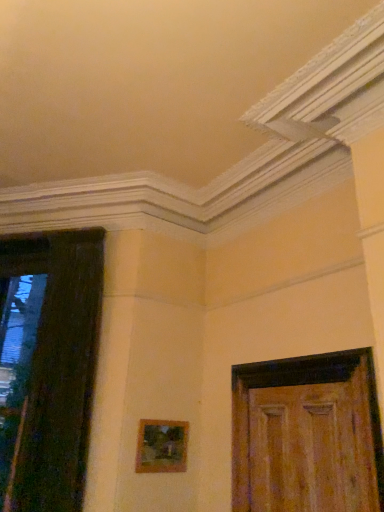
Question: Is wooden frame at center thinner than dark wood door at left, which is counted as the 1th door, starting from the left?

Choices:
 (A) no
 (B) yes

Answer: (B)

Question: From a real-world perspective, is wooden frame at center over dark wood door at left, acting as the 2th door starting from the right?

Choices:
 (A) yes
 (B) no

Answer: (B)

Question: Does wooden frame at center have a smaller size compared to dark wood door at left, which is counted as the 1th door, starting from the left?

Choices:
 (A) yes
 (B) no

Answer: (A)

Question: Is wooden frame at center completely or partially outside of dark wood door at left, which is counted as the 1th door, starting from the left?

Choices:
 (A) no
 (B) yes

Answer: (B)

Question: Is wooden frame at center facing away from dark wood door at left, which is counted as the 1th door, starting from the left?

Choices:
 (A) yes
 (B) no

Answer: (B)

Question: Is wooden frame at center at the left side of dark wood door at left, acting as the 2th door starting from the right?

Choices:
 (A) no
 (B) yes

Answer: (A)

Question: From the image's perspective, is dark wood door at left, which is counted as the 1th door, starting from the left, over wooden frame at center?

Choices:
 (A) no
 (B) yes

Answer: (B)

Question: From a real-world perspective, is dark wood door at left, which is counted as the 1th door, starting from the left, on wooden frame at center?

Choices:
 (A) no
 (B) yes

Answer: (B)

Question: Does dark wood door at left, acting as the 2th door starting from the right, have a lesser height compared to wooden frame at center?

Choices:
 (A) no
 (B) yes

Answer: (A)

Question: Can you confirm if dark wood door at left, which is counted as the 1th door, starting from the left, is bigger than wooden frame at center?

Choices:
 (A) yes
 (B) no

Answer: (A)

Question: Is dark wood door at left, which is counted as the 1th door, starting from the left, thinner than wooden frame at center?

Choices:
 (A) yes
 (B) no

Answer: (B)

Question: Are dark wood door at left, which is counted as the 1th door, starting from the left, and wooden frame at center beside each other?

Choices:
 (A) yes
 (B) no

Answer: (B)

Question: Is wooden door at right, the second door viewed from the left, not inside wooden frame at center?

Choices:
 (A) no
 (B) yes

Answer: (B)